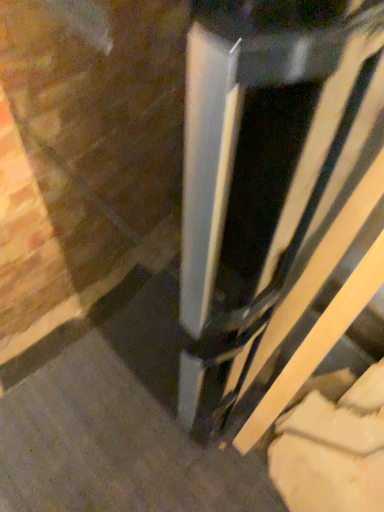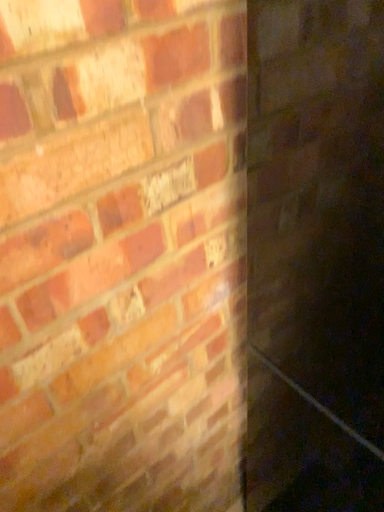
Question: Which way did the camera rotate in the video?

Choices:
 (A) rotated left
 (B) rotated right

Answer: (A)